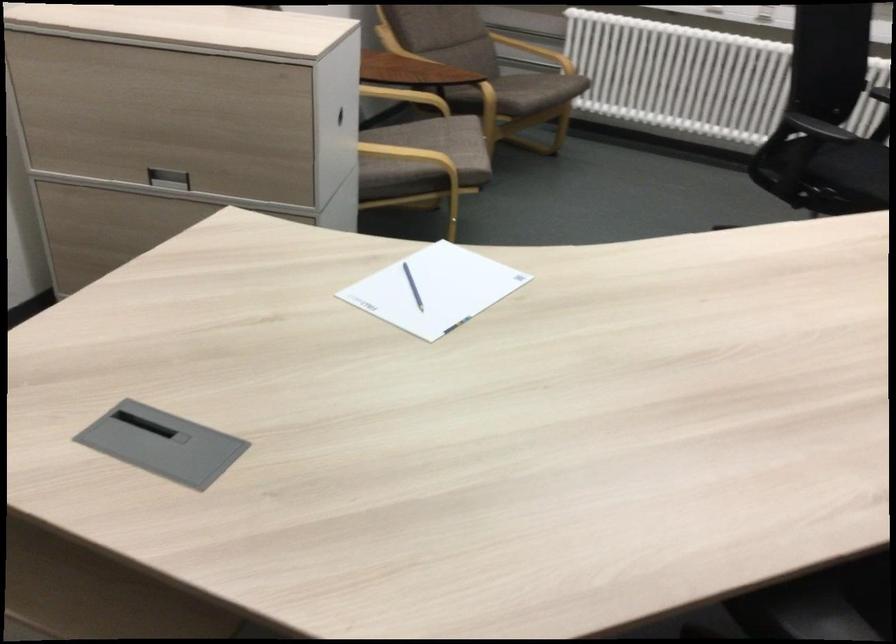
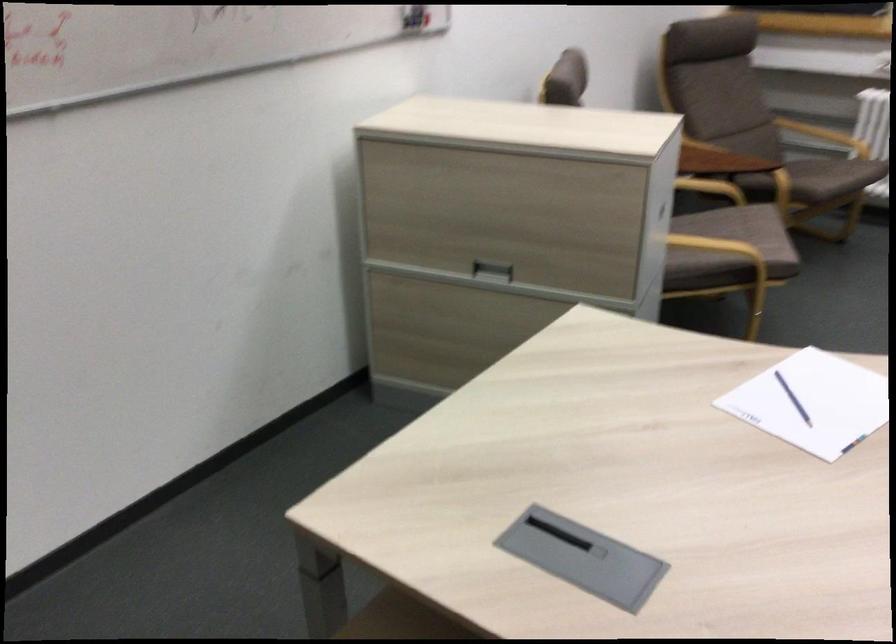
Locate, in the second image, the point that corresponds to (x=444, y=146) in the first image.

(746, 232)